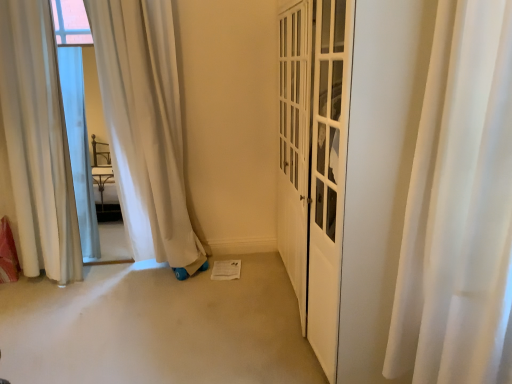
The width and height of the screenshot is (512, 384). I want to click on white sheer curtain at left, which is counted as the second curtain, starting from the front, so click(x=38, y=142).

This screenshot has width=512, height=384. What do you see at coordinates (38, 142) in the screenshot? I see `white sheer curtain at left, acting as the 1th curtain starting from the left` at bounding box center [38, 142].

The height and width of the screenshot is (384, 512). Find the location of `white silky curtain at right, marked as the second curtain in a left-to-right arrangement`. white silky curtain at right, marked as the second curtain in a left-to-right arrangement is located at coordinates (459, 205).

Measure the distance between point (433, 258) and camera.

They are 1.56 meters apart.

Image resolution: width=512 pixels, height=384 pixels. What do you see at coordinates (459, 205) in the screenshot?
I see `white silky curtain at right, which is the 1th curtain from front to back` at bounding box center [459, 205].

Image resolution: width=512 pixels, height=384 pixels. In order to click on white sheer curtain at left, acting as the 1th curtain starting from the left in this screenshot , I will do `click(38, 142)`.

Considering the positions of objects white sheer curtain at left, placed as the second curtain when sorted from right to left, and white silky curtain at right, which is the 1th curtain from front to back, in the image provided, who is more to the left, white sheer curtain at left, placed as the second curtain when sorted from right to left, or white silky curtain at right, which is the 1th curtain from front to back,?

Positioned to the left is white sheer curtain at left, placed as the second curtain when sorted from right to left.

Who is more distant, white sheer curtain at left, arranged as the 1th curtain when viewed from the back, or white silky curtain at right, positioned as the second curtain in back-to-front order?

Positioned behind is white sheer curtain at left, arranged as the 1th curtain when viewed from the back.

Is point (42, 132) farther from camera compared to point (453, 146)?

Yes, point (42, 132) is farther from viewer.

From the picture: From the image's perspective, which is above, white sheer curtain at left, acting as the 1th curtain starting from the left, or white silky curtain at right, which is the 1th curtain from front to back?

white sheer curtain at left, acting as the 1th curtain starting from the left, appears higher in the image.

From a real-world perspective, between white sheer curtain at left, which is counted as the second curtain, starting from the front, and white silky curtain at right, which is the 1th curtain from front to back, who is vertically lower?

In real-world perspective, white silky curtain at right, which is the 1th curtain from front to back, is lower.

Between white sheer curtain at left, acting as the 1th curtain starting from the left, and white silky curtain at right, marked as the 1th curtain in a right-to-left arrangement, which one has larger width?

Wider between the two is white silky curtain at right, marked as the 1th curtain in a right-to-left arrangement.

Considering the relative sizes of white sheer curtain at left, which is counted as the second curtain, starting from the front, and white silky curtain at right, positioned as the second curtain in back-to-front order, in the image provided, is white sheer curtain at left, which is counted as the second curtain, starting from the front, shorter than white silky curtain at right, positioned as the second curtain in back-to-front order,?

In fact, white sheer curtain at left, which is counted as the second curtain, starting from the front, may be taller than white silky curtain at right, positioned as the second curtain in back-to-front order.

From the picture: Who is bigger, white sheer curtain at left, placed as the second curtain when sorted from right to left, or white silky curtain at right, which is the 1th curtain from front to back?

With larger size is white sheer curtain at left, placed as the second curtain when sorted from right to left.

Would you say white sheer curtain at left, acting as the 1th curtain starting from the left, contains white silky curtain at right, marked as the second curtain in a left-to-right arrangement?

No, white silky curtain at right, marked as the second curtain in a left-to-right arrangement, is not inside white sheer curtain at left, acting as the 1th curtain starting from the left.

Is white sheer curtain at left, placed as the second curtain when sorted from right to left, placed right next to white silky curtain at right, marked as the 1th curtain in a right-to-left arrangement?

white sheer curtain at left, placed as the second curtain when sorted from right to left, and white silky curtain at right, marked as the 1th curtain in a right-to-left arrangement, are clearly separated.

Is white sheer curtain at left, arranged as the 1th curtain when viewed from the back, turned away from white silky curtain at right, which is the 1th curtain from front to back?

white sheer curtain at left, arranged as the 1th curtain when viewed from the back, does not have its back to white silky curtain at right, which is the 1th curtain from front to back.

This screenshot has width=512, height=384. I want to click on curtain behind the white silky curtain at right, marked as the second curtain in a left-to-right arrangement, so click(38, 142).

Is white silky curtain at right, positioned as the second curtain in back-to-front order, at the right side of white sheer curtain at left, which is counted as the second curtain, starting from the front?

Correct, you'll find white silky curtain at right, positioned as the second curtain in back-to-front order, to the right of white sheer curtain at left, which is counted as the second curtain, starting from the front.

Between white silky curtain at right, which is the 1th curtain from front to back, and white sheer curtain at left, acting as the 1th curtain starting from the left, which one is positioned in front?

white silky curtain at right, which is the 1th curtain from front to back, is in front.

Does point (415, 293) come in front of point (31, 202)?

Yes, point (415, 293) is in front of point (31, 202).

From the image's perspective, between white silky curtain at right, marked as the 1th curtain in a right-to-left arrangement, and white sheer curtain at left, placed as the second curtain when sorted from right to left, who is located below?

white silky curtain at right, marked as the 1th curtain in a right-to-left arrangement, appears lower in the image.

From a real-world perspective, which object rests below the other?

In real-world perspective, white silky curtain at right, which is the 1th curtain from front to back, is lower.

Considering the sizes of objects white silky curtain at right, marked as the 1th curtain in a right-to-left arrangement, and white sheer curtain at left, acting as the 1th curtain starting from the left, in the image provided, who is thinner, white silky curtain at right, marked as the 1th curtain in a right-to-left arrangement, or white sheer curtain at left, acting as the 1th curtain starting from the left,?

white sheer curtain at left, acting as the 1th curtain starting from the left.

From their relative heights in the image, would you say white silky curtain at right, marked as the second curtain in a left-to-right arrangement, is taller or shorter than white sheer curtain at left, acting as the 1th curtain starting from the left?

Result: white silky curtain at right, marked as the second curtain in a left-to-right arrangement, is shorter than white sheer curtain at left, acting as the 1th curtain starting from the left.

Consider the image. Who is bigger, white silky curtain at right, marked as the second curtain in a left-to-right arrangement, or white sheer curtain at left, acting as the 1th curtain starting from the left?

white sheer curtain at left, acting as the 1th curtain starting from the left.

Is white silky curtain at right, which is the 1th curtain from front to back, positioned beyond the bounds of white sheer curtain at left, acting as the 1th curtain starting from the left?

white silky curtain at right, which is the 1th curtain from front to back, lies outside white sheer curtain at left, acting as the 1th curtain starting from the left,'s area.

Is white silky curtain at right, which is the 1th curtain from front to back, positioned far away from white sheer curtain at left, acting as the 1th curtain starting from the left?

Indeed, white silky curtain at right, which is the 1th curtain from front to back, is not near white sheer curtain at left, acting as the 1th curtain starting from the left.

In the scene shown: Is white silky curtain at right, marked as the second curtain in a left-to-right arrangement, oriented towards white sheer curtain at left, acting as the 1th curtain starting from the left?

No, white silky curtain at right, marked as the second curtain in a left-to-right arrangement, is not turned towards white sheer curtain at left, acting as the 1th curtain starting from the left.

Can you tell me how much white silky curtain at right, marked as the second curtain in a left-to-right arrangement, and white sheer curtain at left, arranged as the 1th curtain when viewed from the back, differ in facing direction?

There is a 91.7-degree angle between the facing directions of white silky curtain at right, marked as the second curtain in a left-to-right arrangement, and white sheer curtain at left, arranged as the 1th curtain when viewed from the back.

Locate an element on the screen. curtain below the white sheer curtain at left, which is counted as the second curtain, starting from the front (from the image's perspective) is located at coordinates (459, 205).

Locate an element on the screen. This screenshot has height=384, width=512. curtain that is above the white silky curtain at right, positioned as the second curtain in back-to-front order (from a real-world perspective) is located at coordinates (38, 142).

Identify the location of curtain on the right of white sheer curtain at left, which is counted as the second curtain, starting from the front. This screenshot has height=384, width=512. point(459,205).